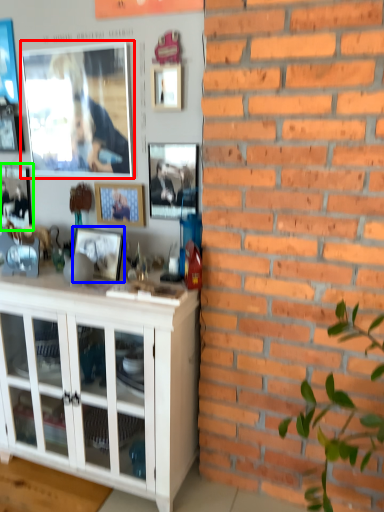
Question: Which object is the closest to the picture frame (highlighted by a red box)? Choose among these: picture frame (highlighted by a blue box) or picture frame (highlighted by a green box).

Choices:
 (A) picture frame
 (B) picture frame

Answer: (B)